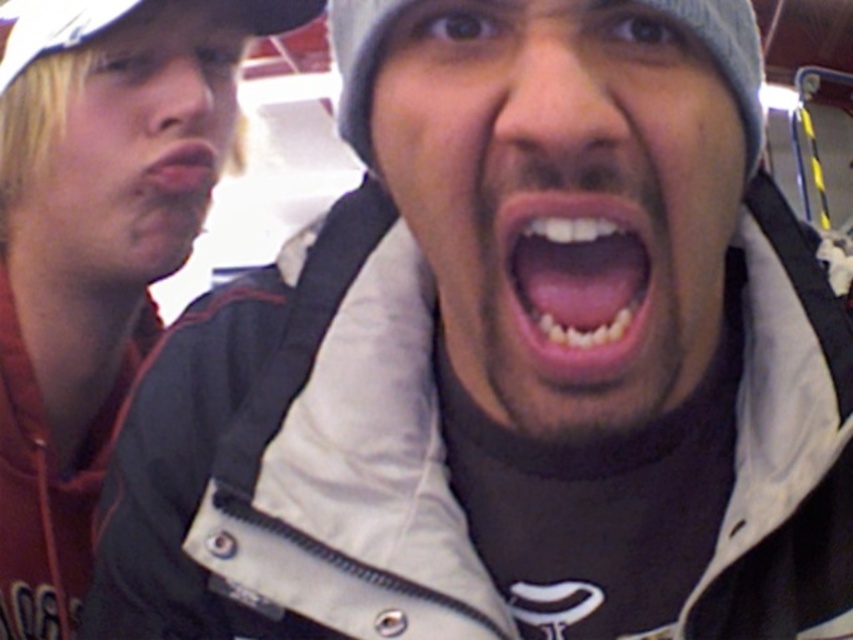
Does blonde hair at left have a greater width compared to gray knit cap at center?

Yes.

Identify the location of blonde hair at left. Image resolution: width=853 pixels, height=640 pixels. (137, 148).

In order to click on blonde hair at left in this screenshot , I will do `click(137, 148)`.

Who is shorter, teeth at center or matte skin at center?

teeth at center

Is teeth at center closer to camera compared to matte skin at center?

Yes, it is in front of matte skin at center.

Who is more distant from viewer, (598,257) or (202,164)?

Point (202,164)

Locate an element on the screen. The width and height of the screenshot is (853, 640). teeth at center is located at coordinates point(573,280).

Is gray woolen hat at center shorter than gray knit cap at center?

Incorrect, gray woolen hat at center's height does not fall short of gray knit cap at center's.

Who is taller, gray woolen hat at center or gray knit cap at center?

Standing taller between the two is gray woolen hat at center.

This screenshot has width=853, height=640. What do you see at coordinates (563, 202) in the screenshot? I see `gray woolen hat at center` at bounding box center [563, 202].

This screenshot has height=640, width=853. I want to click on gray woolen hat at center, so click(563, 202).